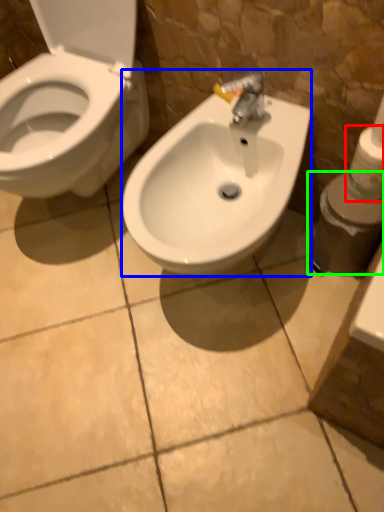
Question: Based on their relative distances, which object is nearer to toilet paper (highlighted by a red box)? Choose from sink (highlighted by a blue box) and toiletries (highlighted by a green box).

Choices:
 (A) sink
 (B) toiletries

Answer: (B)